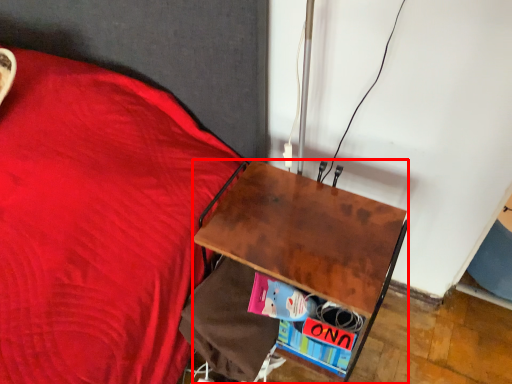
Question: From the image's perspective, what is the correct spatial relationship of desk (annotated by the red box) in relation to paperback book?

Choices:
 (A) below
 (B) above

Answer: (B)